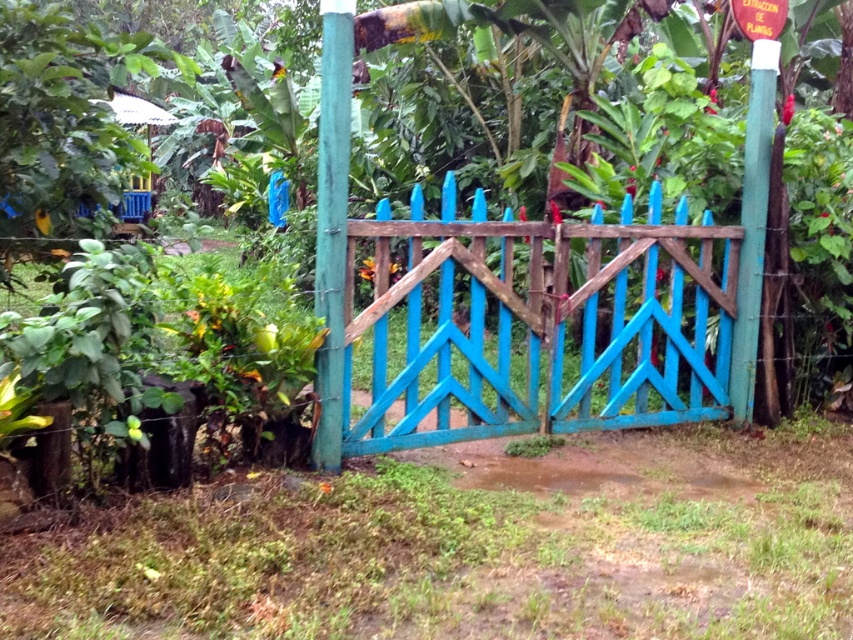
Question: Which point is farther to the camera?

Choices:
 (A) teal wood post at center
 (B) white painted wood pole at upper right
 (C) blue painted wood gate at center

Answer: (B)

Question: In this image, where is blue painted wood gate at center located relative to white painted wood pole at upper right?

Choices:
 (A) below
 (B) above

Answer: (A)

Question: Which of the following is the farthest from the observer?

Choices:
 (A) (633, 426)
 (B) (740, 256)
 (C) (321, 122)

Answer: (B)

Question: Can you confirm if blue painted wood gate at center is positioned above white painted wood pole at upper right?

Choices:
 (A) yes
 (B) no

Answer: (B)

Question: Estimate the real-world distances between objects in this image. Which object is farther from the white painted wood pole at upper right?

Choices:
 (A) blue painted wood gate at center
 (B) teal wood post at center

Answer: (B)

Question: Does blue painted wood gate at center have a smaller size compared to white painted wood pole at upper right?

Choices:
 (A) no
 (B) yes

Answer: (A)